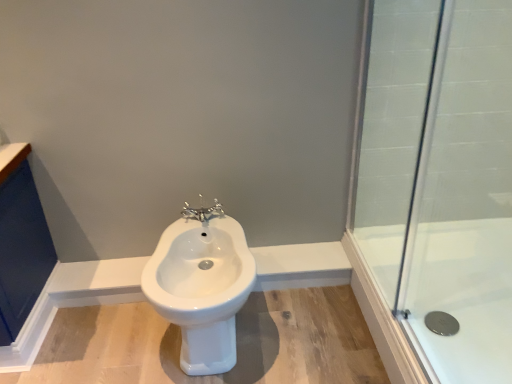
What do you see at coordinates (464, 297) in the screenshot? This screenshot has width=512, height=384. I see `clear glass shower at right` at bounding box center [464, 297].

This screenshot has width=512, height=384. Describe the element at coordinates (440, 180) in the screenshot. I see `transparent glass shower door at right` at that location.

Locate an element on the screen. Image resolution: width=512 pixels, height=384 pixels. clear glass shower at right is located at coordinates (464, 297).

From a real-world perspective, is transparent glass shower door at right positioned above or below chrome metallic faucet at center?

Clearly, from a real-world perspective, transparent glass shower door at right is above chrome metallic faucet at center.

Which of these two, transparent glass shower door at right or chrome metallic faucet at center, stands taller?

transparent glass shower door at right.

From the image's perspective, is transparent glass shower door at right on chrome metallic faucet at center?

No, from the image's perspective, transparent glass shower door at right is not on top of chrome metallic faucet at center.

Where is `tap on the left side of transparent glass shower door at right`? The height and width of the screenshot is (384, 512). tap on the left side of transparent glass shower door at right is located at coordinates (203, 211).

Which of these two, transparent glass shower door at right or clear glass shower at right, is bigger?

clear glass shower at right is bigger.

Based on the photo, between transparent glass shower door at right and clear glass shower at right, which one is positioned behind?

clear glass shower at right is further from the camera.

Looking at their sizes, would you say transparent glass shower door at right is wider or thinner than clear glass shower at right?

Clearly, transparent glass shower door at right has less width compared to clear glass shower at right.

Between point (440, 89) and point (482, 329), which one is positioned in front?

Positioned in front is point (482, 329).

Consider the image. From the image's perspective, is chrome metallic faucet at center under clear glass shower at right?

Incorrect, from the image's perspective, chrome metallic faucet at center is higher than clear glass shower at right.

Which is closer, (x=187, y=217) or (x=418, y=306)?

Point (x=418, y=306)

Is chrome metallic faucet at center in contact with clear glass shower at right?

No, chrome metallic faucet at center is not beside clear glass shower at right.

Which of these two, chrome metallic faucet at center or clear glass shower at right, is thinner?

With smaller width is chrome metallic faucet at center.

Is clear glass shower at right aimed at white glossy bidet at center?

No, clear glass shower at right is not oriented towards white glossy bidet at center.

Is clear glass shower at right positioned in front of white glossy bidet at center?

No, it is behind white glossy bidet at center.

Would you say clear glass shower at right contains white glossy bidet at center?

No, white glossy bidet at center is located outside of clear glass shower at right.

From a real-world perspective, is clear glass shower at right located higher than white glossy bidet at center?

No, from a real-world perspective, clear glass shower at right is not over white glossy bidet at center

Is clear glass shower at right further to the viewer compared to chrome metallic faucet at center?

No, clear glass shower at right is closer to the camera.

Is there a large distance between clear glass shower at right and chrome metallic faucet at center?

No, clear glass shower at right is not far from chrome metallic faucet at center.

Is clear glass shower at right turned away from chrome metallic faucet at center?

That's not correct — clear glass shower at right is not looking away from chrome metallic faucet at center.

Where is `shower door on the right of chrome metallic faucet at center`? The height and width of the screenshot is (384, 512). shower door on the right of chrome metallic faucet at center is located at coordinates (440, 180).

Considering the sizes of chrome metallic faucet at center and transparent glass shower door at right in the image, is chrome metallic faucet at center taller or shorter than transparent glass shower door at right?

In the image, chrome metallic faucet at center appears to be shorter than transparent glass shower door at right.

Considering the positions of objects chrome metallic faucet at center and transparent glass shower door at right in the image provided, who is behind, chrome metallic faucet at center or transparent glass shower door at right?

chrome metallic faucet at center.

From the image's perspective, is chrome metallic faucet at center under transparent glass shower door at right?

No, from the image's perspective, chrome metallic faucet at center is not beneath transparent glass shower door at right.

Does point (227, 311) lie in front of point (502, 86)?

Yes, it is in front of point (502, 86).

Is the depth of white glossy bidet at center less than that of transparent glass shower door at right?

No.

Is white glossy bidet at center placed right next to transparent glass shower door at right?

They are not placed beside each other.

Identify the location of shower door that appears on the right of chrome metallic faucet at center. The image size is (512, 384). (440, 180).

Identify the location of bath below the transparent glass shower door at right (from the image's perspective). This screenshot has width=512, height=384. [464, 297].

In the scene shown: From the image, which object appears to be nearer to white glossy bidet at center, transparent glass shower door at right or clear glass shower at right?

clear glass shower at right is positioned closer to the anchor white glossy bidet at center.

Based on their spatial positions, is chrome metallic faucet at center or transparent glass shower door at right closer to clear glass shower at right?

transparent glass shower door at right lies closer to clear glass shower at right than the other object.

Based on their spatial positions, is clear glass shower at right or transparent glass shower door at right further from white glossy bidet at center?

transparent glass shower door at right lies further to white glossy bidet at center than the other object.

Which object lies further to the anchor point chrome metallic faucet at center, clear glass shower at right or white glossy bidet at center?

The object further to chrome metallic faucet at center is clear glass shower at right.

Looking at the image, which one is located further to transparent glass shower door at right, clear glass shower at right or chrome metallic faucet at center?

Among the two, chrome metallic faucet at center is located further to transparent glass shower door at right.

From the image, which object appears to be farther from clear glass shower at right, chrome metallic faucet at center or white glossy bidet at center?

chrome metallic faucet at center.

Looking at the image, which one is located further to white glossy bidet at center, transparent glass shower door at right or chrome metallic faucet at center?

transparent glass shower door at right is further to white glossy bidet at center.

From the image, which object appears to be nearer to white glossy bidet at center, chrome metallic faucet at center or clear glass shower at right?

Among the two, chrome metallic faucet at center is located nearer to white glossy bidet at center.

The width and height of the screenshot is (512, 384). I want to click on bidet between chrome metallic faucet at center and clear glass shower at right in the horizontal direction, so (201, 288).

Identify the location of bidet positioned between transparent glass shower door at right and chrome metallic faucet at center from near to far. The height and width of the screenshot is (384, 512). (201, 288).

Identify the location of shower door situated between white glossy bidet at center and clear glass shower at right from left to right. The height and width of the screenshot is (384, 512). (440, 180).

This screenshot has width=512, height=384. Find the location of `shower door situated between chrome metallic faucet at center and clear glass shower at right from left to right`. shower door situated between chrome metallic faucet at center and clear glass shower at right from left to right is located at coordinates (440, 180).